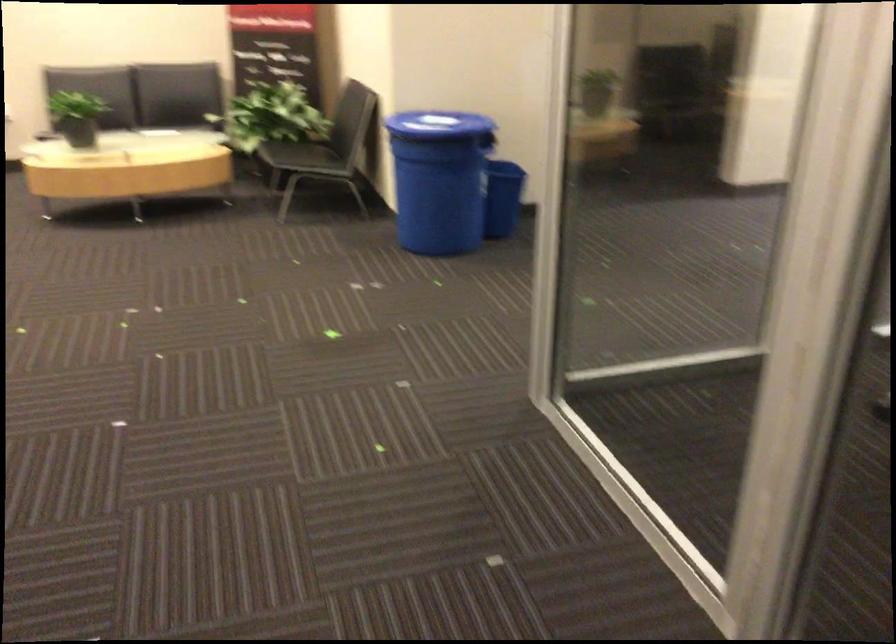
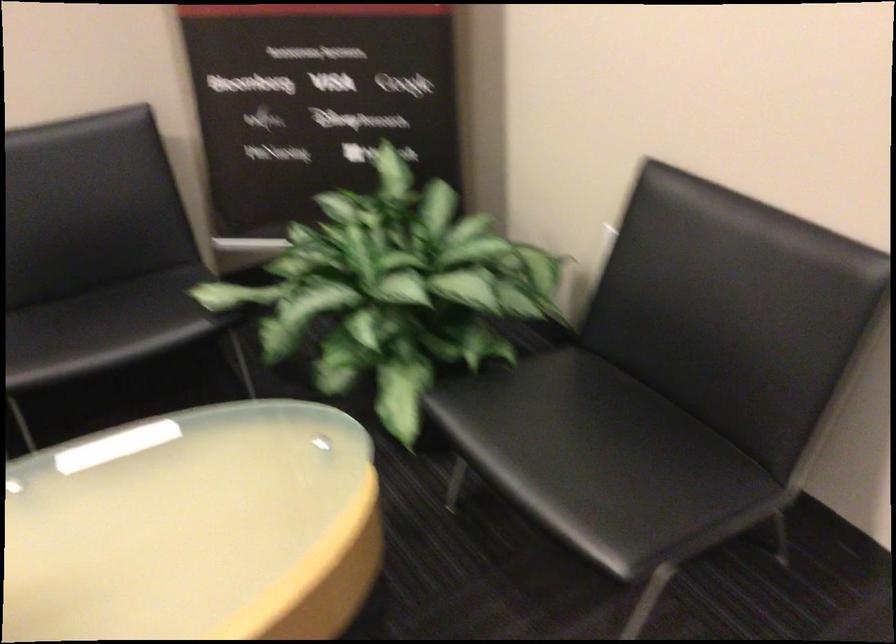
Which direction would the cameraman need to move to produce the second image?

The cameraman walked toward left, forward.